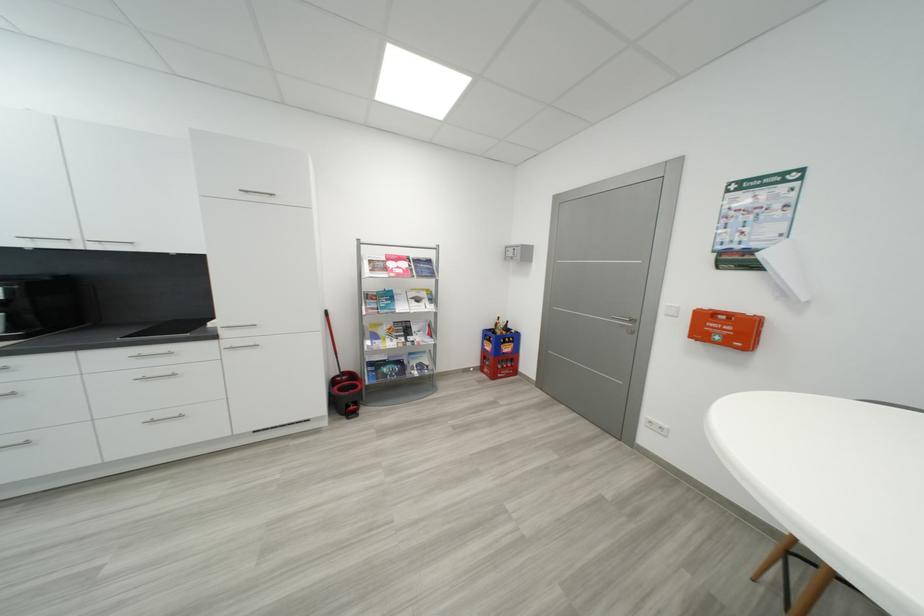
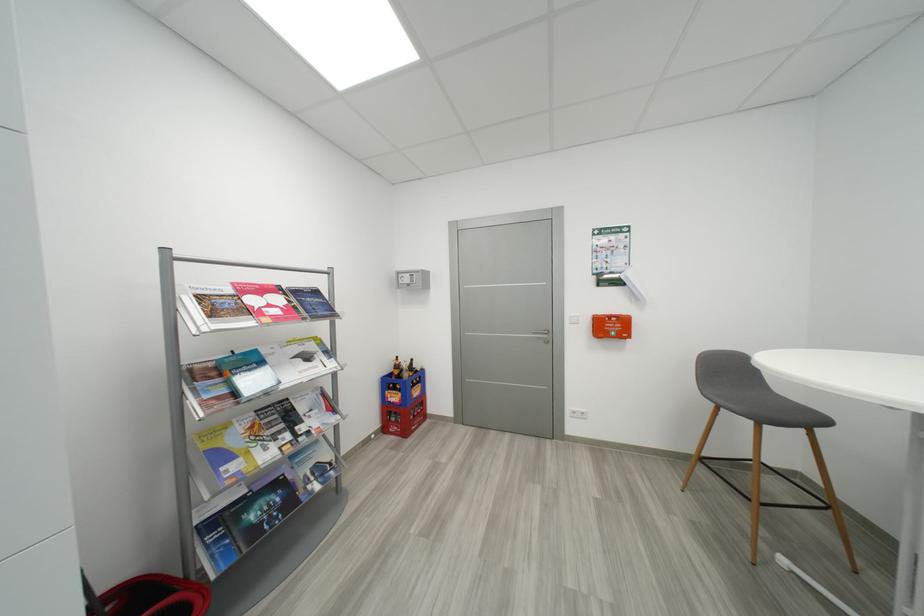
The point at (424,302) is marked in the first image. Where is the corresponding point in the second image?

(314, 359)